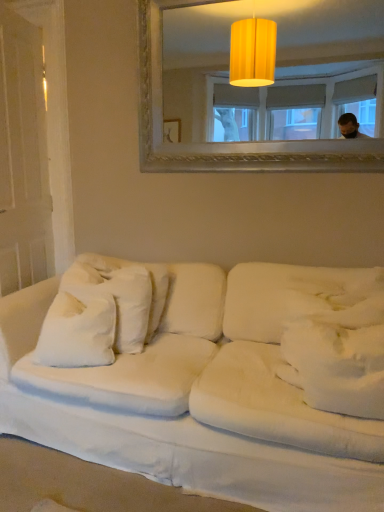
Question: Should I look upward or downward to see matte gold mirror at upper center?

Choices:
 (A) up
 (B) down

Answer: (A)

Question: Does matte gold mirror at upper center appear on the right side of white soft pillow at center, acting as the 1th pillow starting from the right?

Choices:
 (A) no
 (B) yes

Answer: (A)

Question: Is matte gold mirror at upper center aimed at white soft pillow at center, which is the second pillow in left-to-right order?

Choices:
 (A) yes
 (B) no

Answer: (B)

Question: Is matte gold mirror at upper center closer to the viewer compared to white soft pillow at center, the 1th pillow positioned from the front?

Choices:
 (A) yes
 (B) no

Answer: (B)

Question: Is there a large distance between matte gold mirror at upper center and white soft pillow at center, which is the second pillow in left-to-right order?

Choices:
 (A) no
 (B) yes

Answer: (B)

Question: Is matte gold mirror at upper center to the left of white soft pillow at center, acting as the 1th pillow starting from the right, from the viewer's perspective?

Choices:
 (A) no
 (B) yes

Answer: (B)

Question: Is matte gold mirror at upper center positioned behind white soft pillow at center, which is the second pillow in left-to-right order?

Choices:
 (A) yes
 (B) no

Answer: (A)

Question: From the image's perspective, is matte gold mirror at upper center located beneath white soft pillow at left, acting as the 2th pillow starting from the right?

Choices:
 (A) yes
 (B) no

Answer: (B)

Question: From the image's perspective, is matte gold mirror at upper center above white soft pillow at left, acting as the 1th pillow starting from the left?

Choices:
 (A) no
 (B) yes

Answer: (B)

Question: Is matte gold mirror at upper center looking in the opposite direction of white soft pillow at left, acting as the 2th pillow starting from the right?

Choices:
 (A) yes
 (B) no

Answer: (B)

Question: From a real-world perspective, is matte gold mirror at upper center physically above white soft pillow at left, placed as the 2th pillow when sorted from front to back?

Choices:
 (A) no
 (B) yes

Answer: (B)

Question: Considering the relative sizes of matte gold mirror at upper center and white soft pillow at left, which is the 1th pillow from back to front, in the image provided, is matte gold mirror at upper center bigger than white soft pillow at left, which is the 1th pillow from back to front,?

Choices:
 (A) no
 (B) yes

Answer: (B)

Question: Does matte gold mirror at upper center have a greater height compared to white soft pillow at left, acting as the 2th pillow starting from the right?

Choices:
 (A) no
 (B) yes

Answer: (B)

Question: Is white fabric couch at lower center turned away from white soft pillow at left, acting as the 2th pillow starting from the right?

Choices:
 (A) no
 (B) yes

Answer: (B)